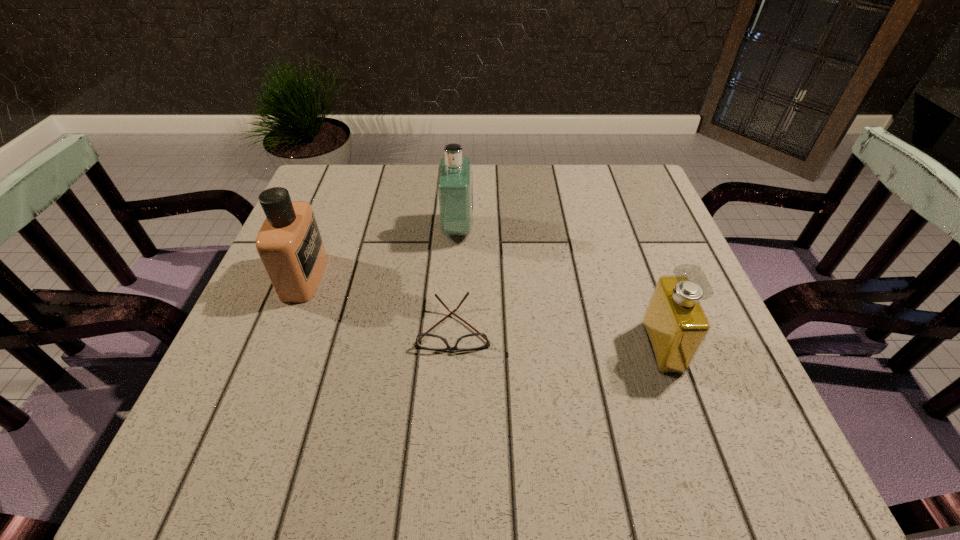
Find the location of a particular element. the farthest object is located at coordinates (454, 185).

Where is `the second perfume from right to left`? The width and height of the screenshot is (960, 540). the second perfume from right to left is located at coordinates (454, 185).

Locate an element on the screen. the third nearest object is located at coordinates (289, 243).

This screenshot has width=960, height=540. In order to click on the second farthest perfume in this screenshot , I will do `click(289, 243)`.

Image resolution: width=960 pixels, height=540 pixels. I want to click on the rightmost perfume, so click(675, 324).

Locate an element on the screen. the nearest perfume is located at coordinates (675, 324).

At what (x,y) coordinates should I click in order to perform the action: click on spectacles. Please return your answer as a coordinate pair (x, y). Looking at the image, I should click on (478, 340).

At what (x,y) coordinates should I click in order to perform the action: click on free space located 0.360m on the front label of the second perfume from right to left. Please return your answer as a coordinate pair (x, y). Looking at the image, I should click on (621, 228).

I want to click on free space located 0.240m on the front label of the second farthest perfume, so click(x=433, y=276).

Find the location of `vacant space located 0.290m on the front-facing side of the rightmost object`. vacant space located 0.290m on the front-facing side of the rightmost object is located at coordinates (492, 347).